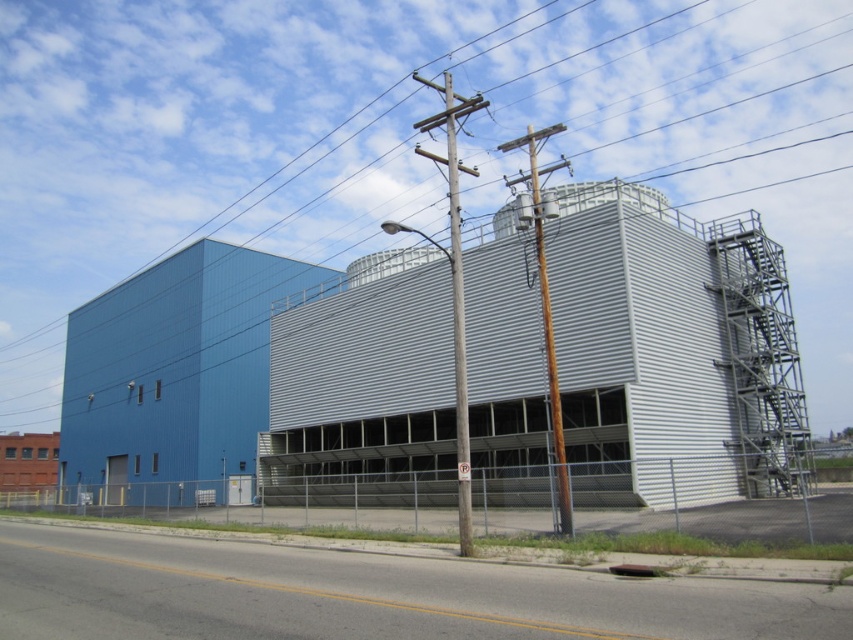
You are a delivery driver approaching the industrial building. You need to know if your truck can pass under the metallic wire at upper center and the wooden utility pole at center. Which one is taller?

The metallic wire at upper center is much taller than the wooden utility pole at center, so the truck can pass under both, but the metallic wire at upper center allows more clearance.

You are standing at the point closest to the building. Which of the two points, point (x=74, y=230) or point (x=463, y=358), is farther away from you?

Point (x=74, y=230) is behind point (x=463, y=358), so it is farther away from you.